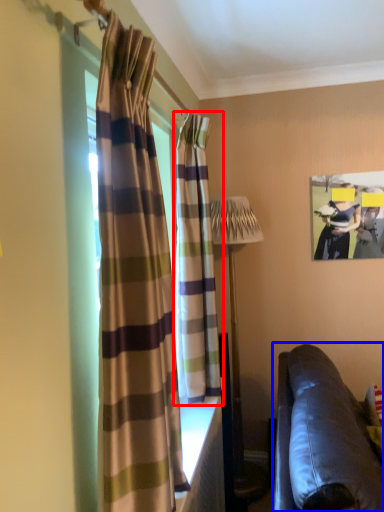
Question: Which point is closer to the camera, curtain (highlighted by a red box) or studio couch (highlighted by a blue box)?

Choices:
 (A) curtain
 (B) studio couch

Answer: (B)